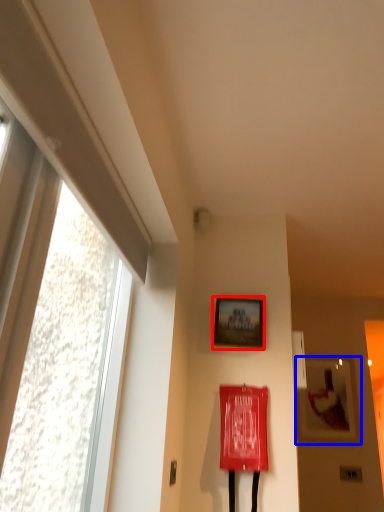
Question: Among these objects, which one is nearest to the camera, picture frame (highlighted by a red box) or picture frame (highlighted by a blue box)?

Choices:
 (A) picture frame
 (B) picture frame

Answer: (A)